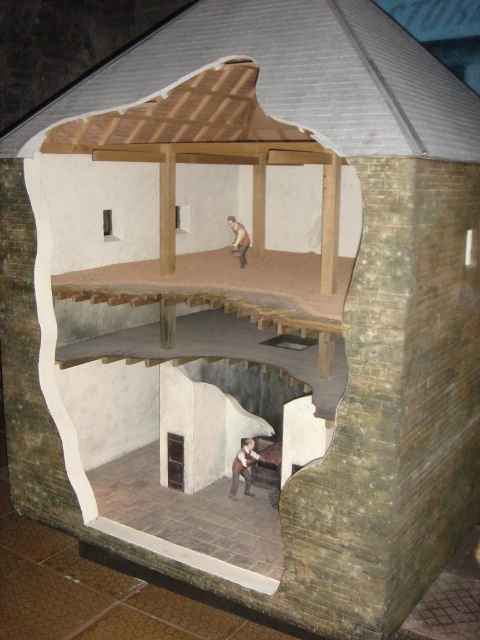
Which is behind, point (245, 456) or point (233, 221)?

Point (233, 221)

Which is in front, point (239, 477) or point (240, 234)?

Point (239, 477) is in front.

The height and width of the screenshot is (640, 480). I want to click on brown leather jacket at lower center, so click(x=243, y=467).

Is point (250, 442) farther from camera compared to point (175, 436)?

No, it is in front of (175, 436).

This screenshot has height=640, width=480. What do you see at coordinates (243, 467) in the screenshot?
I see `brown leather jacket at lower center` at bounding box center [243, 467].

Which is in front, point (248, 440) or point (178, 481)?

Positioned in front is point (248, 440).

Where is `brown leather jacket at lower center`? brown leather jacket at lower center is located at coordinates (243, 467).

In the scene shown: Does dark gray stone hole at lower center come behind smooth beige shirt at upper center?

No, it is not.

This screenshot has width=480, height=640. What are the coordinates of `dark gray stone hole at lower center` in the screenshot? It's located at (175, 461).